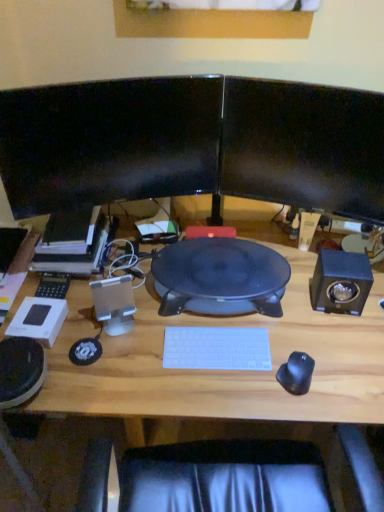
I want to click on free spot in front of black rubberized mouse at right, so click(x=300, y=410).